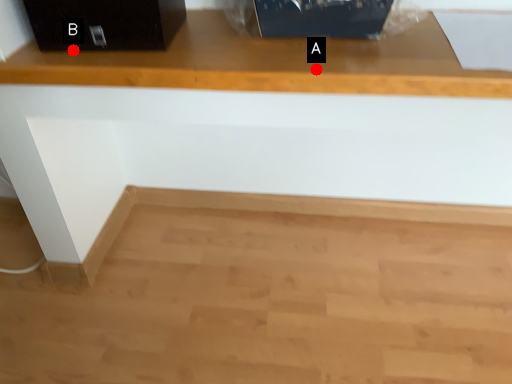
Question: Two points are circled on the image, labeled by A and B beside each circle. Which point is closer to the camera taking this photo?

Choices:
 (A) A is closer
 (B) B is closer

Answer: (A)